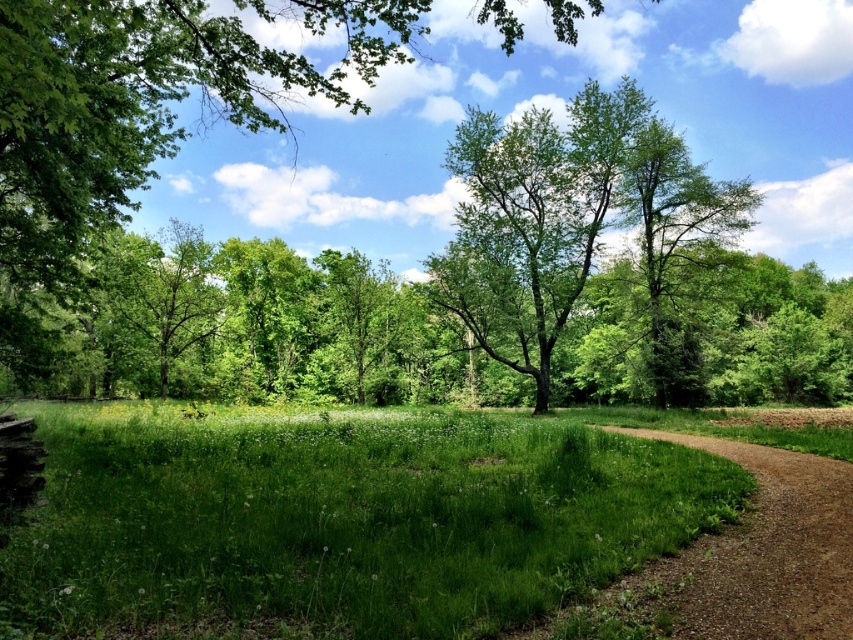
Can you confirm if green grassy field at lower left is positioned below green leafy tree at upper center?

Indeed, green grassy field at lower left is positioned under green leafy tree at upper center.

Does green grassy field at lower left have a greater width compared to green leafy tree at upper center?

No.

Which is in front, point (747, 486) or point (20, 112)?

Point (20, 112)

Locate an element on the screen. This screenshot has width=853, height=640. green grassy field at lower left is located at coordinates (340, 520).

Is point (90, 4) positioned after point (154, 320)?

That is False.

Does green leafy tree at upper center have a lesser width compared to green leafy tree at left?

No.

Image resolution: width=853 pixels, height=640 pixels. Find the location of `green leafy tree at upper center`. green leafy tree at upper center is located at coordinates (148, 99).

Does point (157, 355) come in front of point (26, 464)?

No, it is not.

Does green leafy tree at left appear over rustic wooden bench at lower left?

Indeed, green leafy tree at left is positioned over rustic wooden bench at lower left.

Locate an element on the screen. The height and width of the screenshot is (640, 853). green leafy tree at left is located at coordinates coord(165,289).